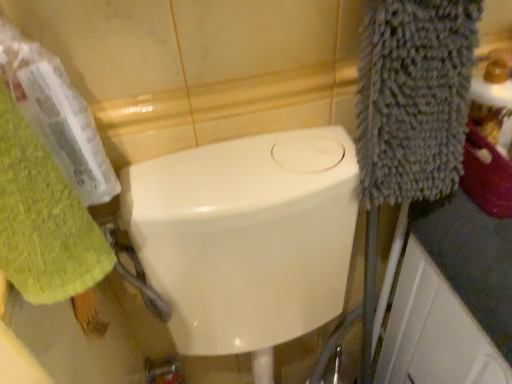
Question: From the image's perspective, is green textured towel at left above or below white glossy bidet at center?

Choices:
 (A) below
 (B) above

Answer: (B)

Question: In the image, is green textured towel at left positioned in front of or behind white glossy bidet at center?

Choices:
 (A) behind
 (B) front

Answer: (B)

Question: In terms of size, does green textured towel at left appear bigger or smaller than white glossy bidet at center?

Choices:
 (A) small
 (B) big

Answer: (A)

Question: Based on their positions, is white glossy bidet at center located to the left or right of green textured towel at left?

Choices:
 (A) left
 (B) right

Answer: (B)

Question: Looking at their shapes, would you say white glossy bidet at center is wider or thinner than green textured towel at left?

Choices:
 (A) thin
 (B) wide

Answer: (B)

Question: Would you say white glossy bidet at center is inside or outside green textured towel at left?

Choices:
 (A) inside
 (B) outside

Answer: (B)

Question: Is point (308, 162) positioned closer to the camera than point (66, 284)?

Choices:
 (A) closer
 (B) farther

Answer: (B)